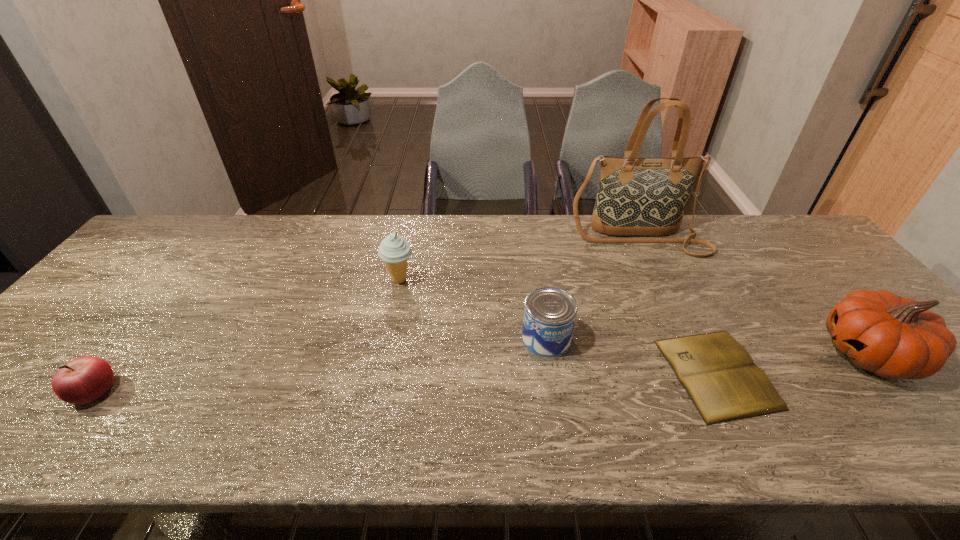
At what (x,y) coordinates should I click in order to perform the action: click on free spot between the icecream and the third object from left to right. Please return your answer as a coordinate pair (x, y). Looking at the image, I should click on (473, 309).

Identify the location of free space between the can and the book. The width and height of the screenshot is (960, 540). (632, 356).

Locate an element on the screen. This screenshot has height=540, width=960. vacant space in between the book and the pumpkin is located at coordinates 793,364.

The image size is (960, 540). Find the location of `unoccupied area between the fourth tallest object and the fifth object from right to left`. unoccupied area between the fourth tallest object and the fifth object from right to left is located at coordinates (473, 309).

Image resolution: width=960 pixels, height=540 pixels. Find the location of `unoccupied area between the pumpkin and the farthest object`. unoccupied area between the pumpkin and the farthest object is located at coordinates (754, 295).

Locate an element on the screen. This screenshot has width=960, height=540. object that ranks as the closest to the pumpkin is located at coordinates (719, 375).

Locate which object ranks second in proximity to the shortest object. Please provide its 2D coordinates. Your answer should be formatted as a tuple, i.e. [(x, y)], where the tuple contains the x and y coordinates of a point satisfying the conditions above.

[(549, 315)]

The height and width of the screenshot is (540, 960). What are the coordinates of `vacant space that satisfies the following two spatial constraints: 1. on the front-facing side of the tallest object; 2. on the right side of the shortest object` in the screenshot? It's located at (700, 374).

This screenshot has width=960, height=540. Find the location of `free point that satisfies the following two spatial constraints: 1. on the back side of the apple; 2. on the right side of the icecream`. free point that satisfies the following two spatial constraints: 1. on the back side of the apple; 2. on the right side of the icecream is located at coordinates (180, 280).

Where is `free location that satisfies the following two spatial constraints: 1. on the front-facing side of the tallest object; 2. on the left side of the shortest object`? The image size is (960, 540). free location that satisfies the following two spatial constraints: 1. on the front-facing side of the tallest object; 2. on the left side of the shortest object is located at coordinates (700, 374).